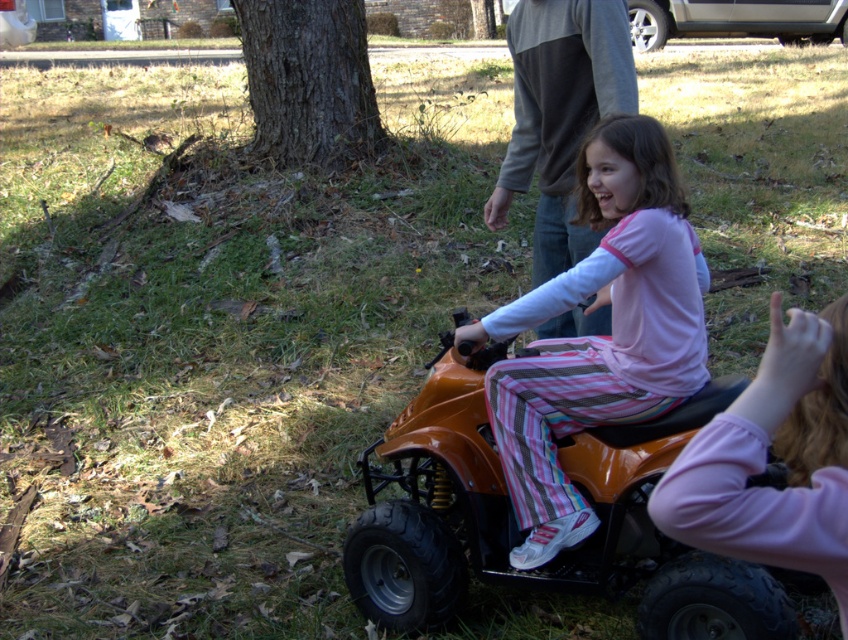
Which of these two, pink fabric hand at lower right or gray sweater at upper center, stands shorter?

pink fabric hand at lower right is shorter.

Is point (806, 458) more distant than point (626, 64)?

No, (806, 458) is closer to viewer.

This screenshot has width=848, height=640. Identify the location of pink fabric hand at lower right. (777, 454).

Locate an element on the screen. The width and height of the screenshot is (848, 640). pink fabric hand at lower right is located at coordinates (777, 454).

Which of these two, matte orange quad bike at center or orange plastic toy car at upper right, stands taller?

matte orange quad bike at center is taller.

Between point (611, 355) and point (835, 22), which one is positioned behind?

Point (835, 22)

Who is more forward, (x=678, y=312) or (x=801, y=17)?

Point (x=678, y=312) is more forward.

The height and width of the screenshot is (640, 848). In order to click on matte orange quad bike at center in this screenshot , I will do `click(598, 336)`.

Is orange rubber toy car at center to the right of orange plastic toy car at upper right from the viewer's perspective?

Incorrect, orange rubber toy car at center is not on the right side of orange plastic toy car at upper right.

Is point (606, 496) more distant than point (679, 12)?

No, it is in front of (679, 12).

Where is `orange rubber toy car at center`? Image resolution: width=848 pixels, height=640 pixels. orange rubber toy car at center is located at coordinates (520, 531).